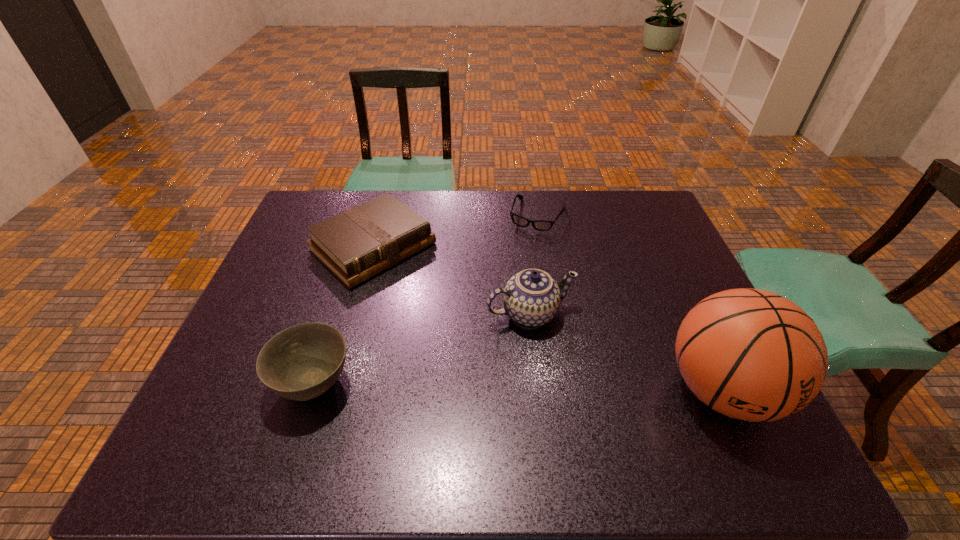
I want to click on free region located on the front-facing side of the shortest object, so click(490, 323).

Locate an element on the screen. The width and height of the screenshot is (960, 540). vacant space located on the spine side of the second shortest object is located at coordinates (429, 293).

The width and height of the screenshot is (960, 540). I want to click on vacant space situated on the spine side of the second shortest object, so click(439, 300).

Identify the location of vacant area situated on the spine side of the second shortest object. This screenshot has height=540, width=960. (473, 329).

Identify the location of vacant space located 0.120m at the spout of the second tallest object. The image size is (960, 540). (565, 373).

I want to click on vacant space located 0.230m at the spout of the second tallest object, so click(x=587, y=414).

Identify the location of free space located at the spout of the second tallest object. (561, 362).

In order to click on spectacles that is at the far edge in this screenshot , I will do `click(541, 225)`.

The image size is (960, 540). What are the coordinates of `Bible situated at the far edge` in the screenshot? It's located at (359, 243).

Where is `bowl present at the near edge`? The image size is (960, 540). bowl present at the near edge is located at coordinates (302, 362).